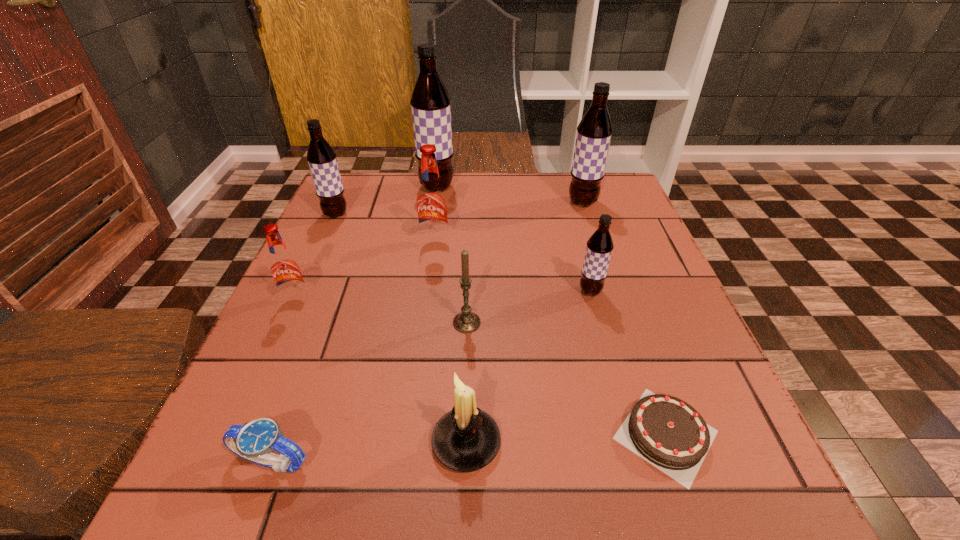
In order to click on vacant area between the second smallest brown root beer and the farther red root beer in this screenshot , I will do `click(386, 230)`.

You are a GUI agent. You are given a task and a screenshot of the screen. Output one action in this format:
    pyautogui.click(x=<x>, y=<y>)
    Task: Click on the object that is the ninth closest one to the leftmost brown root beer
    The image size is (960, 540).
    Given the screenshot: What is the action you would take?
    point(667,432)

The width and height of the screenshot is (960, 540). Find the location of `object that is the seventh closest to the candle`. object that is the seventh closest to the candle is located at coordinates (321, 157).

Select which root beer is the third closest to the watch. Please provide its 2D coordinates. Your answer should be formatted as a tuple, i.e. [(x, y)], where the tuple contains the x and y coordinates of a point satisfying the conditions above.

[(599, 247)]

Find the location of a particular element. The height and width of the screenshot is (540, 960). root beer that is the third closest to the smallest brown root beer is located at coordinates (430, 102).

In order to click on brown root beer that stands as the closest to the nearest brown root beer in this screenshot , I will do `click(594, 131)`.

Locate which brown root beer is the second closest to the fifth shortest root beer. Please provide its 2D coordinates. Your answer should be formatted as a tuple, i.e. [(x, y)], where the tuple contains the x and y coordinates of a point satisfying the conditions above.

[(430, 102)]

The image size is (960, 540). In order to click on free region that satisfies the following two spatial constraints: 1. on the back side of the left red root beer; 2. on the right side of the farther red root beer in this screenshot , I will do `click(323, 245)`.

Where is `vacant area that satisfies the following two spatial constraints: 1. on the front side of the second smallest brown root beer; 2. on the left side of the farther red root beer`? The image size is (960, 540). vacant area that satisfies the following two spatial constraints: 1. on the front side of the second smallest brown root beer; 2. on the left side of the farther red root beer is located at coordinates (323, 245).

Where is `free point that satisfies the following two spatial constraints: 1. on the front side of the candle holder; 2. on the left side of the seventh farthest object`? This screenshot has width=960, height=540. free point that satisfies the following two spatial constraints: 1. on the front side of the candle holder; 2. on the left side of the seventh farthest object is located at coordinates (463, 442).